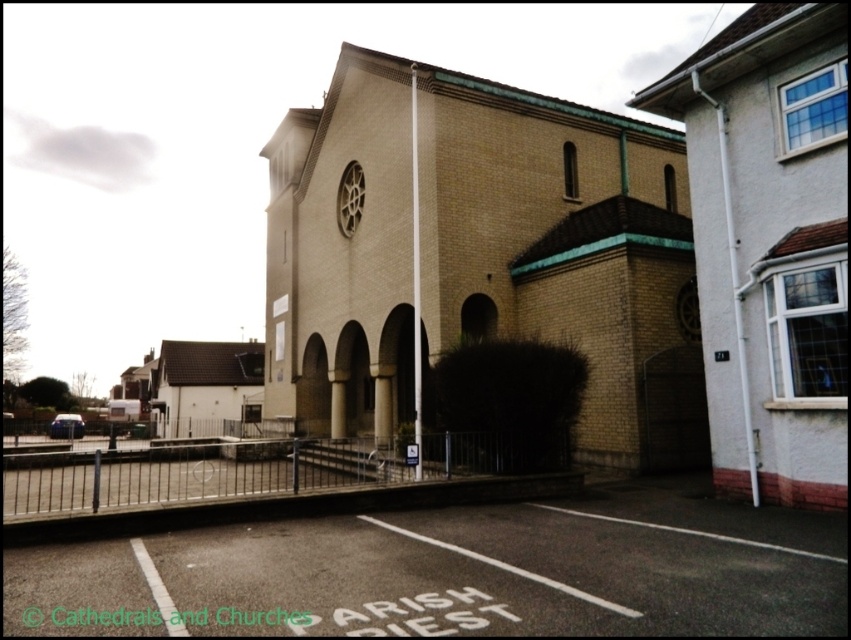
Question: Which of the following is the closest to the observer?

Choices:
 (A) beige brick church at center
 (B) dark asphalt parking lot at lower center

Answer: (B)

Question: Estimate the real-world distances between objects in this image. Which object is closer to the dark asphalt parking lot at lower center?

Choices:
 (A) matte brick church at right
 (B) beige brick church at center

Answer: (A)

Question: Is beige brick church at center smaller than matte brick church at right?

Choices:
 (A) yes
 (B) no

Answer: (B)

Question: Does beige brick church at center come in front of matte brick church at right?

Choices:
 (A) no
 (B) yes

Answer: (A)

Question: Is beige brick church at center closer to camera compared to dark asphalt parking lot at lower center?

Choices:
 (A) yes
 (B) no

Answer: (B)

Question: Estimate the real-world distances between objects in this image. Which object is farther from the dark asphalt parking lot at lower center?

Choices:
 (A) matte brick church at right
 (B) beige brick church at center

Answer: (B)